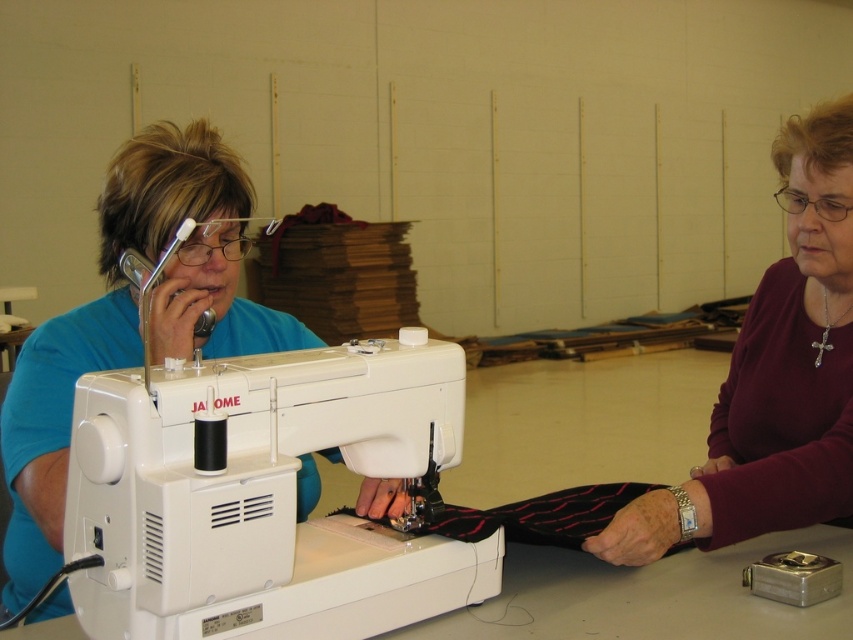
You are a sewing instructor observing the workshop scene. You notice the white plastic sewing machine at center and the blue fabric at left. Which object is located closer to the front of the scene?

The blue fabric at left is closer to the front of the scene because the white plastic sewing machine at center is positioned under it, indicating it is behind.